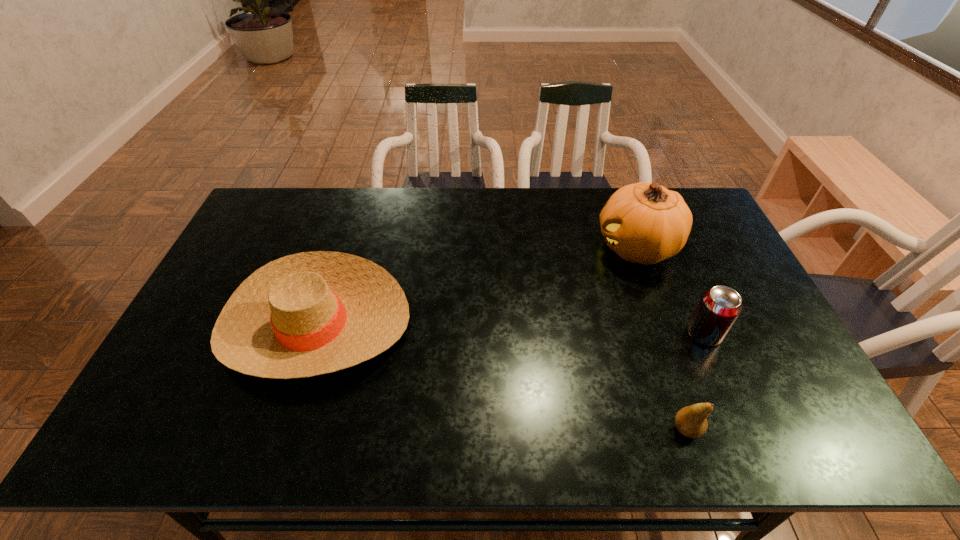
Identify the location of free space that is in between the soda can and the pumpkin. This screenshot has width=960, height=540. (670, 291).

At what (x,y) coordinates should I click in order to perform the action: click on unoccupied position between the sunhat and the soda can. Please return your answer as a coordinate pair (x, y). Image resolution: width=960 pixels, height=540 pixels. Looking at the image, I should click on (510, 329).

At what (x,y) coordinates should I click in order to perform the action: click on free space between the nearest object and the soda can. Please return your answer as a coordinate pair (x, y). This screenshot has width=960, height=540. Looking at the image, I should click on (695, 381).

The height and width of the screenshot is (540, 960). In order to click on object identified as the closest to the soda can in this screenshot , I will do `click(646, 223)`.

This screenshot has width=960, height=540. Identify the location of the second closest object relative to the sunhat. (690, 421).

You are a GUI agent. You are given a task and a screenshot of the screen. Output one action in this format:
    pyautogui.click(x=<x>, y=<y>)
    Task: Click on the vacant space that satisfies the following two spatial constraints: 1. on the front face of the pumpkin; 2. on the back side of the soda can
    Image resolution: width=960 pixels, height=540 pixels.
    Given the screenshot: What is the action you would take?
    pyautogui.click(x=668, y=334)

This screenshot has height=540, width=960. Identify the location of blank space that satisfies the following two spatial constraints: 1. on the back side of the soda can; 2. on the right side of the pear. (655, 334).

You are a GUI agent. You are given a task and a screenshot of the screen. Output one action in this format:
    pyautogui.click(x=<x>, y=<y>)
    Task: Click on the vacant position in the image that satisfies the following two spatial constraints: 1. on the front face of the pumpkin; 2. on the back side of the soda can
    The image size is (960, 540).
    Given the screenshot: What is the action you would take?
    pyautogui.click(x=668, y=334)

Locate an element on the screen. The image size is (960, 540). free space in the image that satisfies the following two spatial constraints: 1. on the front face of the pumpkin; 2. on the back side of the soda can is located at coordinates (668, 334).

At what (x,y) coordinates should I click in order to perform the action: click on vacant region that satisfies the following two spatial constraints: 1. on the front face of the soda can; 2. on the right side of the pumpkin. Please return your answer as a coordinate pair (x, y). Image resolution: width=960 pixels, height=540 pixels. Looking at the image, I should click on (668, 334).